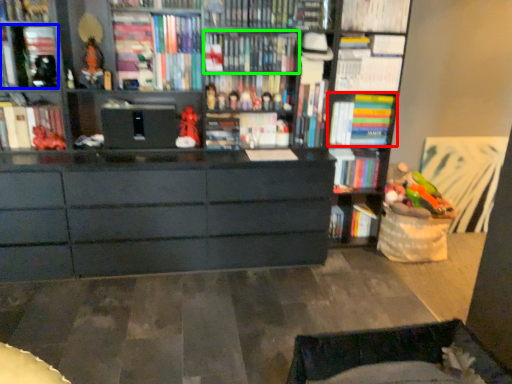
Question: Which object is the closest to the book (highlighted by a red box)? Choose among these: book (highlighted by a blue box) or book (highlighted by a green box).

Choices:
 (A) book
 (B) book

Answer: (B)